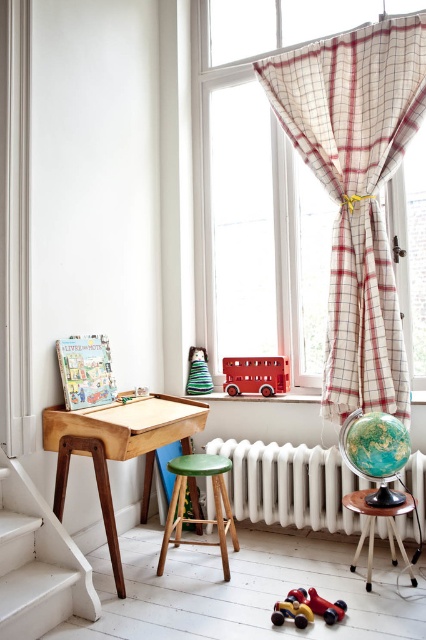
In the scene shown: You are organizing a play area and need to decide where to place a new toy. The green matte stool at center and the green striped fabric cone at center are both in the center of the desk. Which object takes up more space on the desk?

The green matte stool at center has a larger size compared to the green striped fabric cone at center, so it takes up more space on the desk.

You are a parent setting up a play area for your child. You have a toy box that is 1.2 meters wide. You want to place it between the white textured radiator at center and the wooden desk at lower left. Is there enough space?

The white textured radiator at center is wider than the wooden desk at lower left. However, the exact dimensions of the space between them are not provided, so it is uncertain if the 1.2 meter toy box will fit. You may need to measure the distance between the two objects to confirm.